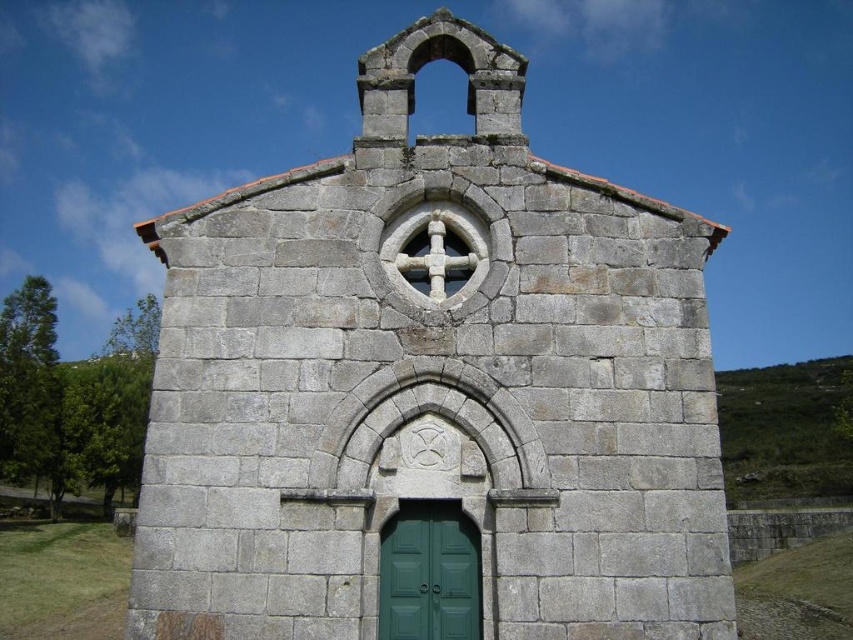
You are an architect analyzing the chapel structure. You need to determine if the green wooden door at center can be replaced with a taller door without exceeding the height of the white stone cross at center. Can this be done?

The green wooden door at center has a lesser height compared to white stone cross at center, so a taller door could be installed as long as it does not exceed the height of the white stone cross at center.

Please describe the position of the gray stone church at center in terms of coordinates within the image frame. Use the coordinate system where the bottom left corner is the origin point.

The gray stone church at center is located at coordinates approximately 0.608 along the x axis and 0.508 along the y axis within the image frame.

You are standing in front of the chapel and want to touch both the green wooden door at center and the white stone cross at center. Which object should you reach for first?

You should reach for the green wooden door at center first since it is closer to you than the white stone cross at center.